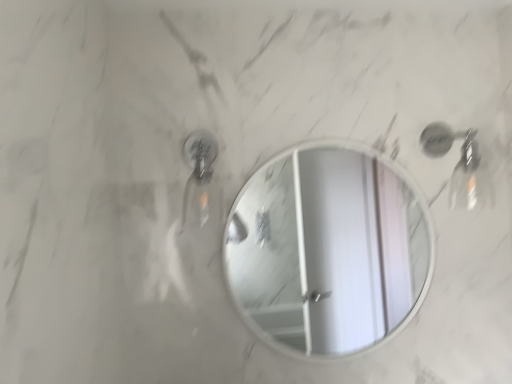
Locate an element on the screen. clear glass mirror at center is located at coordinates (328, 249).

Describe the element at coordinates (328, 249) in the screenshot. I see `clear glass mirror at center` at that location.

This screenshot has height=384, width=512. What are the coordinates of `clear glass mirror at center` in the screenshot? It's located at (328, 249).